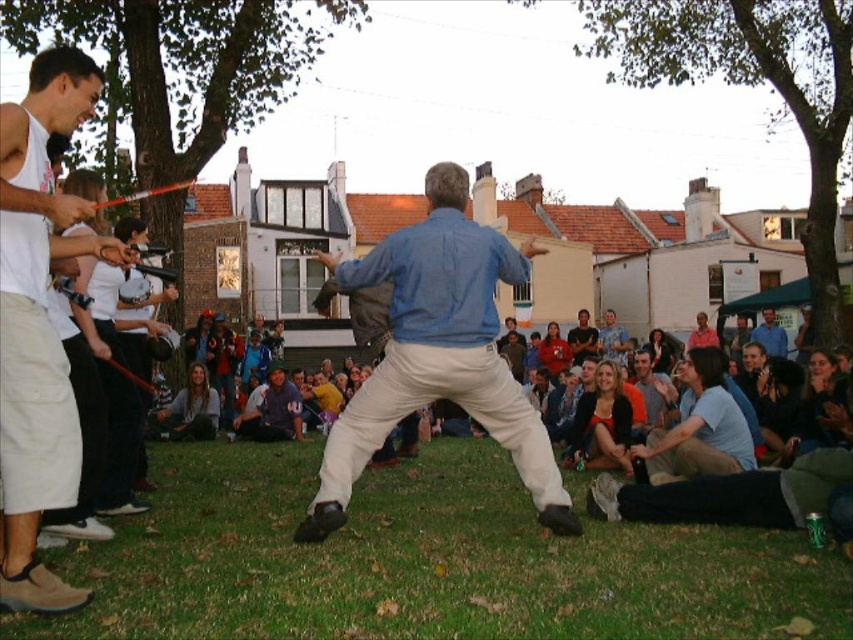
Based on the photo, can you confirm if green grass at lower center is positioned to the left of white cotton tank top at left?

In fact, green grass at lower center is to the right of white cotton tank top at left.

Is green grass at lower center positioned in front of white cotton tank top at left?

Yes.

Image resolution: width=853 pixels, height=640 pixels. Find the location of `green grass at lower center`. green grass at lower center is located at coordinates (424, 561).

Find the location of a particular element. This screenshot has height=640, width=853. green grass at lower center is located at coordinates (424, 561).

Is blue cotton shirt at center further to camera compared to white cotton tank top at left?

Yes, it is behind white cotton tank top at left.

Between blue cotton shirt at center and white cotton tank top at left, which one is positioned higher?

white cotton tank top at left is above.

Is point (379, 273) positioned behind point (1, 115)?

That is True.

Identify the location of blue cotton shirt at center. point(438,353).

Is green grass at lower center positioned before blue cotton shirt at center?

Yes, green grass at lower center is in front of blue cotton shirt at center.

You are a GUI agent. You are given a task and a screenshot of the screen. Output one action in this format:
    pyautogui.click(x=<x>, y=<y>)
    Task: Click on the green grass at lower center
    The width and height of the screenshot is (853, 640).
    Given the screenshot: What is the action you would take?
    pyautogui.click(x=424, y=561)

Is point (576, 502) positioned before point (393, 348)?

No, it is not.

Where is `green grass at lower center`? The width and height of the screenshot is (853, 640). green grass at lower center is located at coordinates (424, 561).